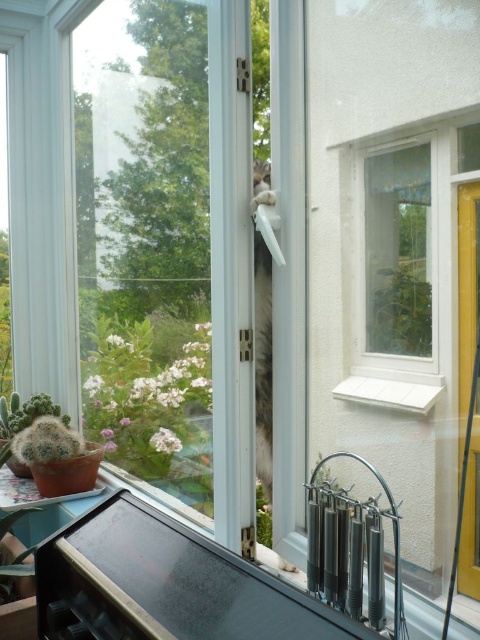
Based on the photo, measure the distance between green matte plant at left and green leafy plant at upper right.

They are 73.35 centimeters apart.

Can you confirm if green matte plant at left is thinner than green leafy plant at upper right?

In fact, green matte plant at left might be wider than green leafy plant at upper right.

Is point (96, 372) positioned behind point (371, 340)?

Yes, point (96, 372) is behind point (371, 340).

Image resolution: width=480 pixels, height=640 pixels. In order to click on green matte plant at left in this screenshot , I will do `click(147, 397)`.

Is yellow matte screen door at right closer to camera compared to white matte window sill at lower center?

Yes, yellow matte screen door at right is in front of white matte window sill at lower center.

Is yellow matte screen door at right bigger than white matte window sill at lower center?

Correct, yellow matte screen door at right is larger in size than white matte window sill at lower center.

Is point (471, 308) positioned before point (419, 388)?

Yes, it is in front of point (419, 388).

You are a GUI agent. You are given a task and a screenshot of the screen. Output one action in this format:
    pyautogui.click(x=<x>, y=<y>)
    Task: Click on the yellow matte screen door at right
    This screenshot has width=480, height=640.
    Given the screenshot: What is the action you would take?
    (x=468, y=384)

Does green fuzzy cactus at lower left appear under green matte cactus at lower left?

No.

In the scene shown: Does green fuzzy cactus at lower left have a greater height compared to green matte cactus at lower left?

In fact, green fuzzy cactus at lower left may be shorter than green matte cactus at lower left.

Does point (68, 419) lie in front of point (36, 509)?

No.

The height and width of the screenshot is (640, 480). In order to click on green fuzzy cactus at lower left in this screenshot , I will do `click(25, 412)`.